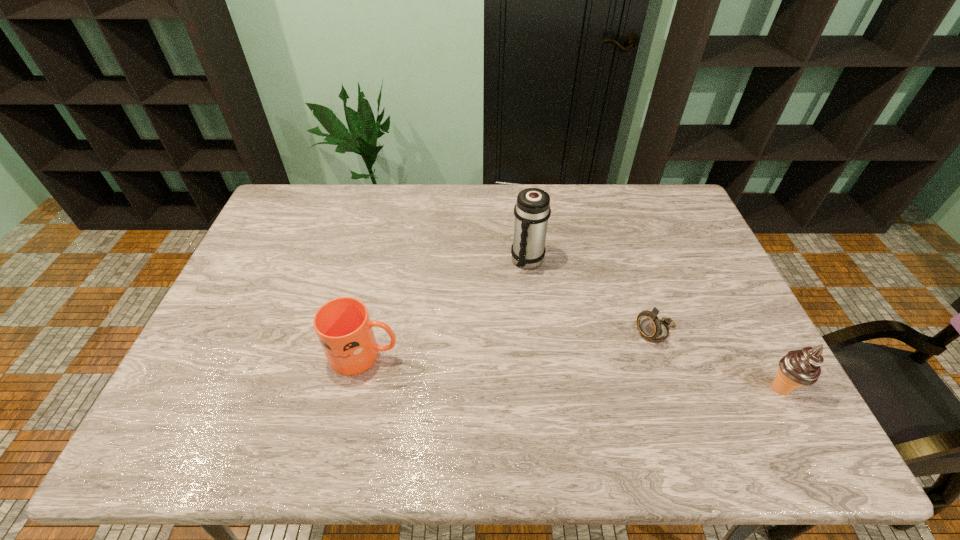
Image resolution: width=960 pixels, height=540 pixels. In order to click on free space on the desktop that is between the leftmost object and the rightmost object and is positioned on the face of the compass in this screenshot , I will do `click(582, 373)`.

This screenshot has width=960, height=540. Find the location of `free space on the desktop that is between the leftmost object and the rightmost object and is positioned on the side with the handle of the second object from left to right`. free space on the desktop that is between the leftmost object and the rightmost object and is positioned on the side with the handle of the second object from left to right is located at coordinates click(x=511, y=367).